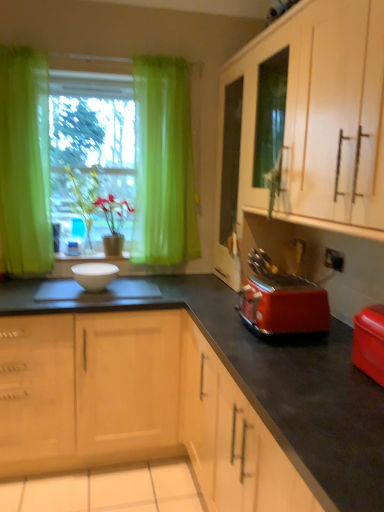
Question: Are red plastic toaster at lower right and white glossy bowl at center beside each other?

Choices:
 (A) no
 (B) yes

Answer: (A)

Question: From the image's perspective, is red plastic toaster at lower right on white glossy bowl at center?

Choices:
 (A) no
 (B) yes

Answer: (A)

Question: Would you say red plastic toaster at lower right is outside white glossy bowl at center?

Choices:
 (A) yes
 (B) no

Answer: (A)

Question: From a real-world perspective, is red plastic toaster at lower right below white glossy bowl at center?

Choices:
 (A) yes
 (B) no

Answer: (B)

Question: Can you confirm if red plastic toaster at lower right is positioned to the right of white glossy bowl at center?

Choices:
 (A) no
 (B) yes

Answer: (B)

Question: From the image's perspective, is green leafy plant at center positioned above or below matte plastic container at lower right?

Choices:
 (A) below
 (B) above

Answer: (B)

Question: Based on their positions, is green leafy plant at center located to the left or right of matte plastic container at lower right?

Choices:
 (A) right
 (B) left

Answer: (B)

Question: Choose the correct answer: Is green leafy plant at center inside matte plastic container at lower right or outside it?

Choices:
 (A) outside
 (B) inside

Answer: (A)

Question: Considering the positions of green leafy plant at center and matte plastic container at lower right in the image, is green leafy plant at center taller or shorter than matte plastic container at lower right?

Choices:
 (A) tall
 (B) short

Answer: (A)

Question: Based on their positions, is matte plastic container at lower right located to the left or right of white glossy bowl at center?

Choices:
 (A) right
 (B) left

Answer: (A)

Question: In terms of size, does matte plastic container at lower right appear bigger or smaller than white glossy bowl at center?

Choices:
 (A) small
 (B) big

Answer: (B)

Question: From their relative heights in the image, would you say matte plastic container at lower right is taller or shorter than white glossy bowl at center?

Choices:
 (A) tall
 (B) short

Answer: (A)

Question: From the image's perspective, is matte plastic container at lower right above or below white glossy bowl at center?

Choices:
 (A) below
 (B) above

Answer: (A)

Question: In terms of size, does white glossy bowl at center appear bigger or smaller than red plastic toaster at lower right?

Choices:
 (A) big
 (B) small

Answer: (B)

Question: From a real-world perspective, is white glossy bowl at center physically located above or below red plastic toaster at lower right?

Choices:
 (A) above
 (B) below

Answer: (B)